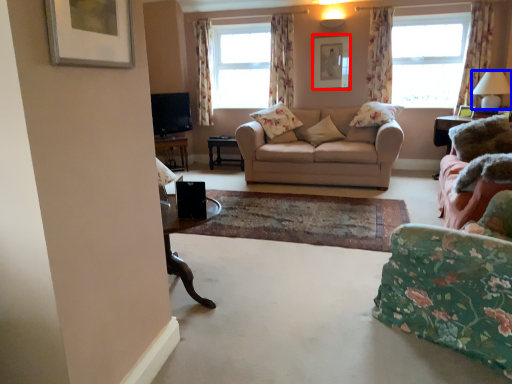
Question: Among these objects, which one is nearest to the camera, picture frame (highlighted by a red box) or lamp (highlighted by a blue box)?

Choices:
 (A) picture frame
 (B) lamp

Answer: (B)